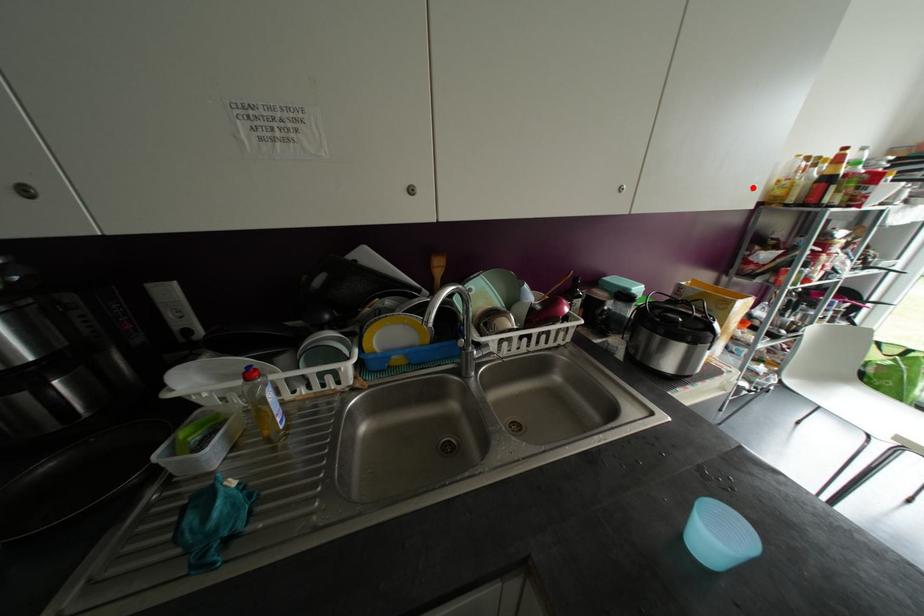
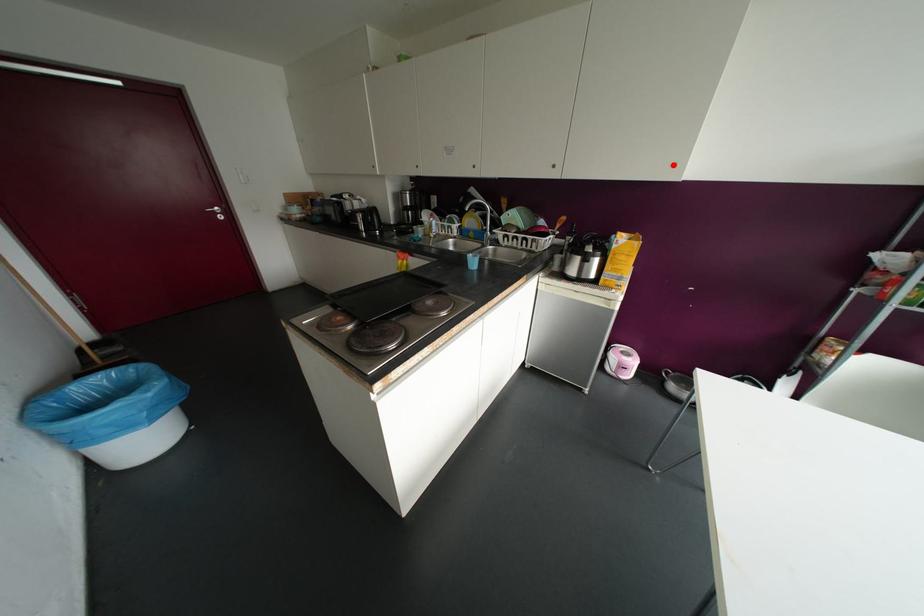
I am providing you with two images of the same scene from different viewpoints. A red point is marked on the first image and another point is marked on the second image. Are the points marked in image1 and image2 representing the same 3D position?

Yes